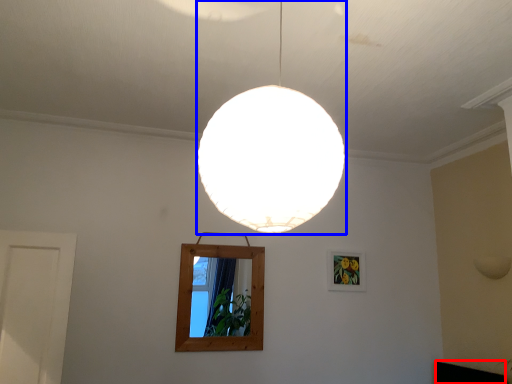
Question: Which point is further to the camera, furniture (highlighted by a red box) or lamp (highlighted by a blue box)?

Choices:
 (A) furniture
 (B) lamp

Answer: (A)